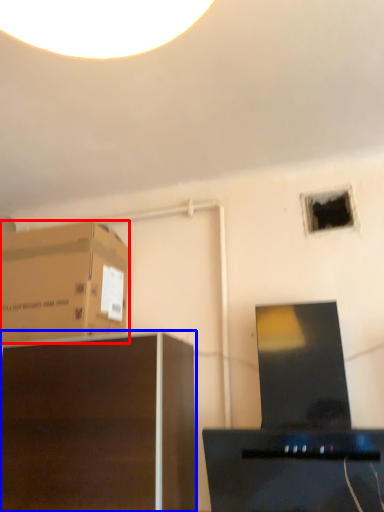
Question: Which object is closer to the camera taking this photo, cardboard box (highlighted by a red box) or furniture (highlighted by a blue box)?

Choices:
 (A) cardboard box
 (B) furniture

Answer: (B)